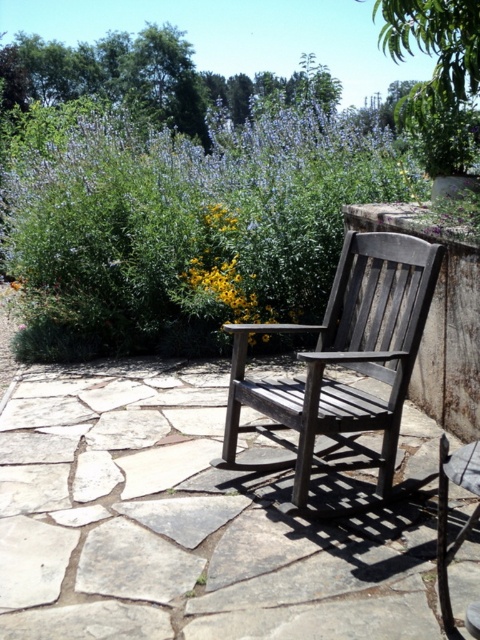
Question: Does dark gray wood chair at center appear over yellow matte flower at center?

Choices:
 (A) yes
 (B) no

Answer: (B)

Question: Is dark gray wood chair at center positioned at the back of yellow matte flower at center?

Choices:
 (A) yes
 (B) no

Answer: (B)

Question: Which point is farther to the camera?

Choices:
 (A) dark gray wood chair at center
 (B) yellow matte flower at center

Answer: (B)

Question: Which point appears farthest from the camera in this image?

Choices:
 (A) click(x=398, y=284)
 (B) click(x=227, y=291)

Answer: (B)

Question: Can you confirm if dark gray wood chair at center is bigger than yellow matte flower at center?

Choices:
 (A) no
 (B) yes

Answer: (B)

Question: Which point is closer to the camera?

Choices:
 (A) dark gray wood chair at center
 (B) yellow matte flower at center

Answer: (A)